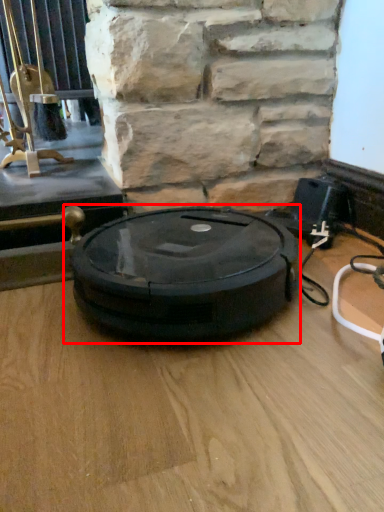
Question: From the image's perspective, where is weight scale (annotated by the red box) located relative to window?

Choices:
 (A) below
 (B) above

Answer: (A)